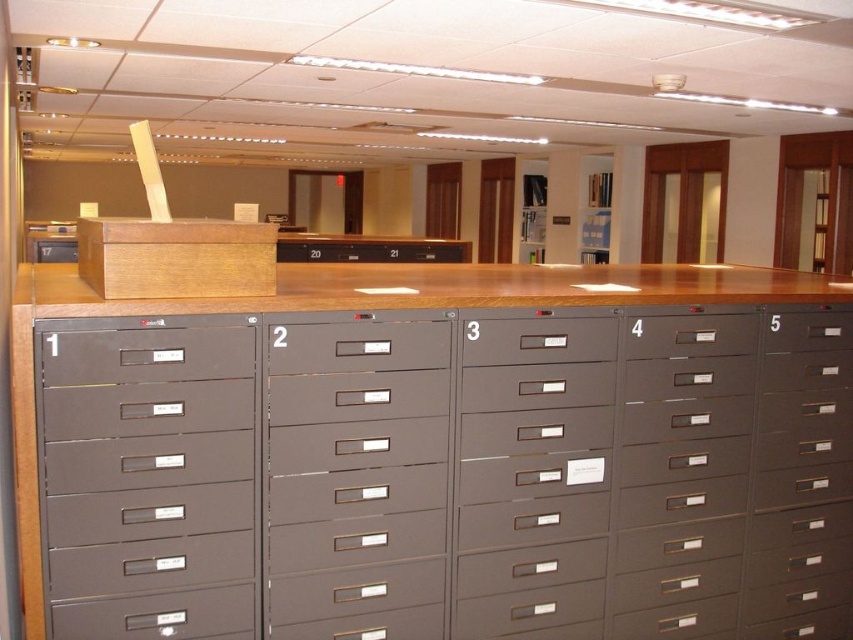
Does gray matte drawer at center have a greater width compared to matte gray drawer at right?

Indeed, gray matte drawer at center has a greater width compared to matte gray drawer at right.

Which is more to the right, gray matte drawer at center or matte gray drawer at right?

From the viewer's perspective, matte gray drawer at right appears more on the right side.

Is point (364, 330) positioned in front of point (848, 328)?

That is True.

Locate an element on the screen. This screenshot has width=853, height=640. gray matte drawer at center is located at coordinates (357, 346).

Who is positioned more to the left, matte gray drawer at center or matte gray drawer at right?

Positioned to the left is matte gray drawer at center.

Can you confirm if matte gray drawer at center is wider than matte gray drawer at right?

Indeed, matte gray drawer at center has a greater width compared to matte gray drawer at right.

Which is in front, point (463, 328) or point (769, 323)?

Positioned in front is point (463, 328).

The width and height of the screenshot is (853, 640). In order to click on matte gray drawer at center in this screenshot , I will do `click(538, 339)`.

Identify the location of brown wood table at center. The image size is (853, 640). (450, 465).

Measure the distance between brown wood table at center and camera.

brown wood table at center and camera are 1.85 meters apart.

The height and width of the screenshot is (640, 853). Find the location of `brown wood table at center`. brown wood table at center is located at coordinates (450, 465).